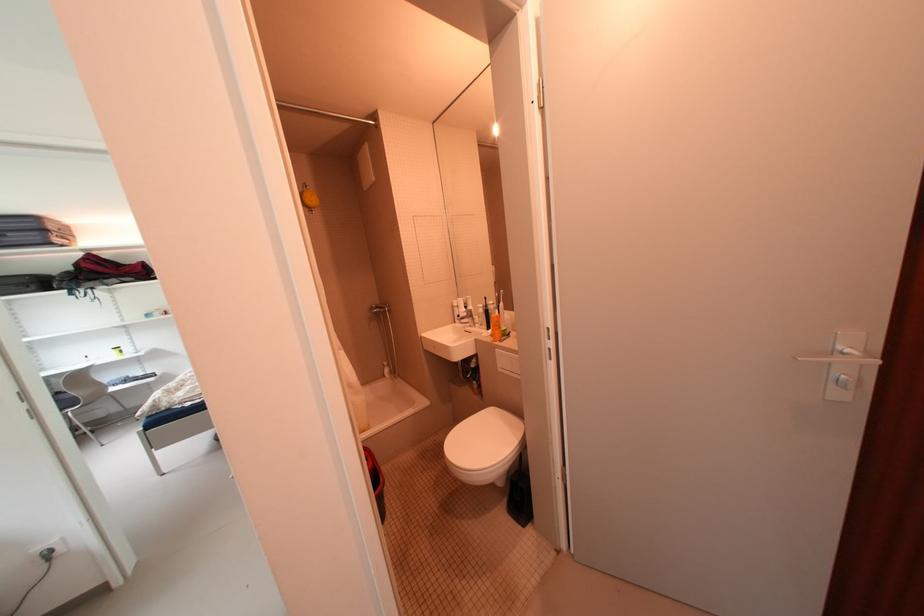
You are a GUI agent. You are given a task and a screenshot of the screen. Output one action in this format:
    pyautogui.click(x=<x>, y=<y>)
    Task: Click on the sink faucet handle
    This screenshot has width=924, height=616.
    Given the screenshot: What is the action you would take?
    pyautogui.click(x=466, y=314)